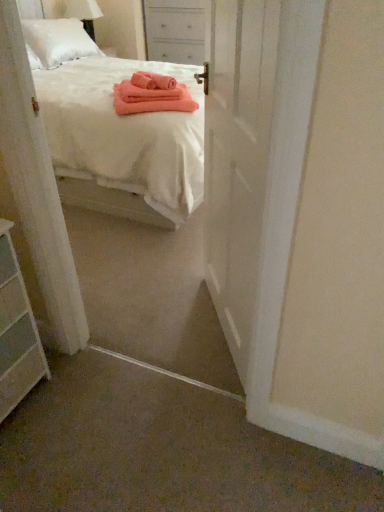
Question: From the image's perspective, is white cotton bed at center positioned above or below white glossy door at center?

Choices:
 (A) below
 (B) above

Answer: (B)

Question: Visually, is white cotton bed at center positioned to the left or to the right of white glossy door at center?

Choices:
 (A) right
 (B) left

Answer: (B)

Question: Based on their relative distances, which object is farther from the white painted wood nightstand at upper center?

Choices:
 (A) white matte chest of drawers at lower left
 (B) white glossy door at center
 (C) white cotton bed at center

Answer: (A)

Question: Based on their relative distances, which object is farther from the white cotton bed at center?

Choices:
 (A) white glossy door at center
 (B) white painted wood nightstand at upper center
 (C) white matte chest of drawers at lower left

Answer: (C)